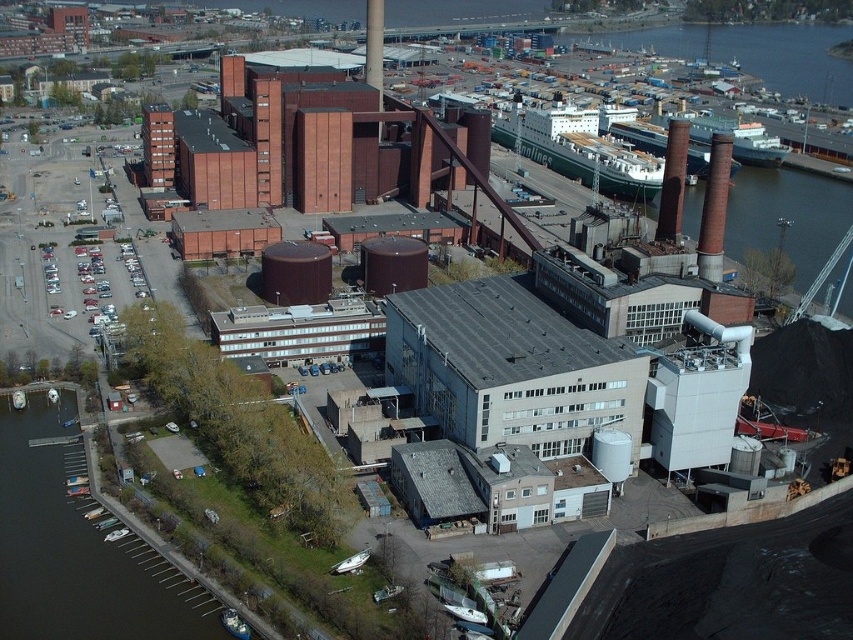
You are a drone operator tasked with capturing aerial footage of the industrial complex. You need to ensure that both the rustic brick chimney at upper right and the smooth brick chimney at upper right are clearly visible in the frame. Which chimney should you focus on first if you want to highlight the one with a larger diameter?

The smooth brick chimney at upper right has a larger diameter than the rustic brick chimney at upper right, so you should focus on the smooth brick chimney at upper right first to highlight its size.

You are a drone operator trying to capture a photo of the dark green water at lower left. The camera has a maximum zoom range of 100 meters. Can you get a clear photo without moving the drone closer?

The dark green water at lower left and camera are 121.32 meters apart from each other. Since the maximum zoom is 100 meters, the drone cannot capture a clear photo without moving closer.